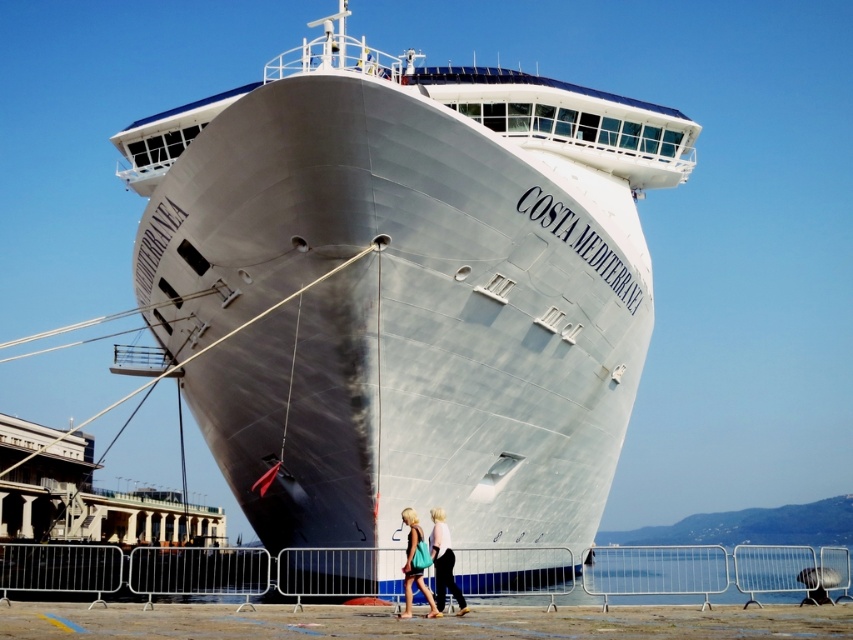
Question: Does polished steel ship at center have a lesser width compared to matte blue dress at center?

Choices:
 (A) yes
 (B) no

Answer: (B)

Question: Observing the image, what is the correct spatial positioning of polished steel ship at center in reference to matte blue dress at center?

Choices:
 (A) above
 (B) below

Answer: (A)

Question: Is polished steel ship at center above matte blue dress at center?

Choices:
 (A) yes
 (B) no

Answer: (A)

Question: Which of the following is the closest to the observer?

Choices:
 (A) polished steel ship at center
 (B) matte blue dress at center

Answer: (A)